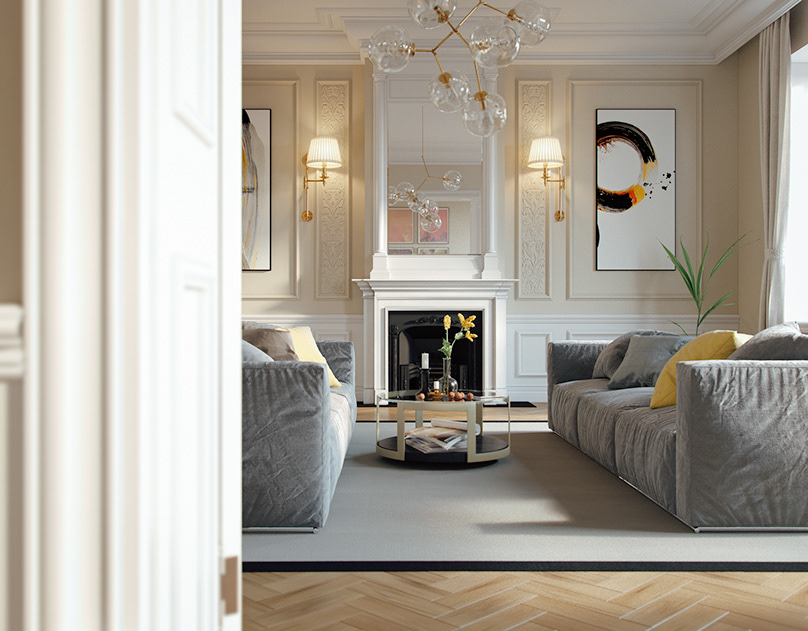
The image size is (808, 631). In order to click on door in this screenshot , I will do `click(198, 438)`.